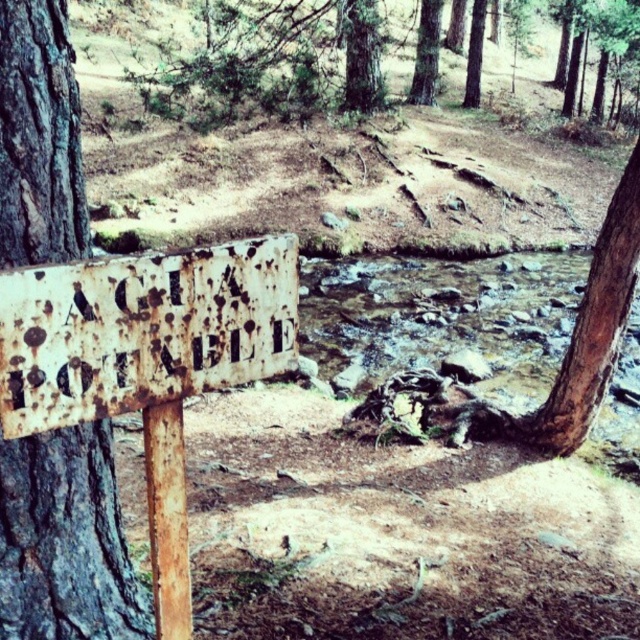
Question: Is rusty wood post at lower left bigger than green textured bark tree at center?

Choices:
 (A) no
 (B) yes

Answer: (A)

Question: Which point is closer to the camera?

Choices:
 (A) (360, 81)
 (B) (180, 376)

Answer: (B)

Question: Which point is closer to the camera?

Choices:
 (A) smooth brown tree trunk at upper center
 (B) green rough bark tree at upper center
 (C) rusty metal sign at lower left

Answer: (C)

Question: Which point is closer to the camera taking this photo?

Choices:
 (A) (157, 436)
 (B) (424, 74)
 (C) (472, 6)

Answer: (A)

Question: Does rusty metal sign at left appear under smooth brown tree trunk at upper center?

Choices:
 (A) yes
 (B) no

Answer: (A)

Question: Where is rusty metal sign at left located in relation to green rough bark tree at upper center in the image?

Choices:
 (A) above
 (B) below

Answer: (B)